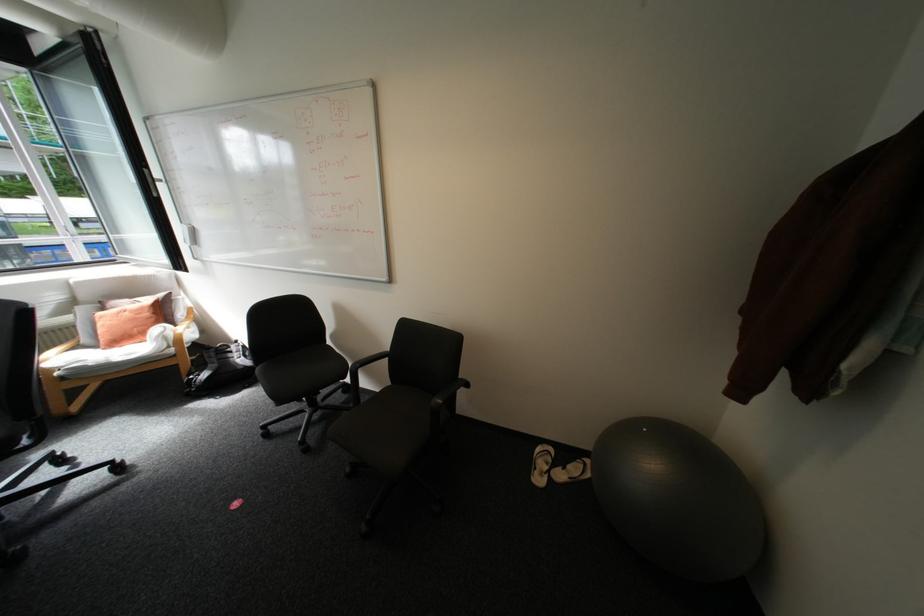
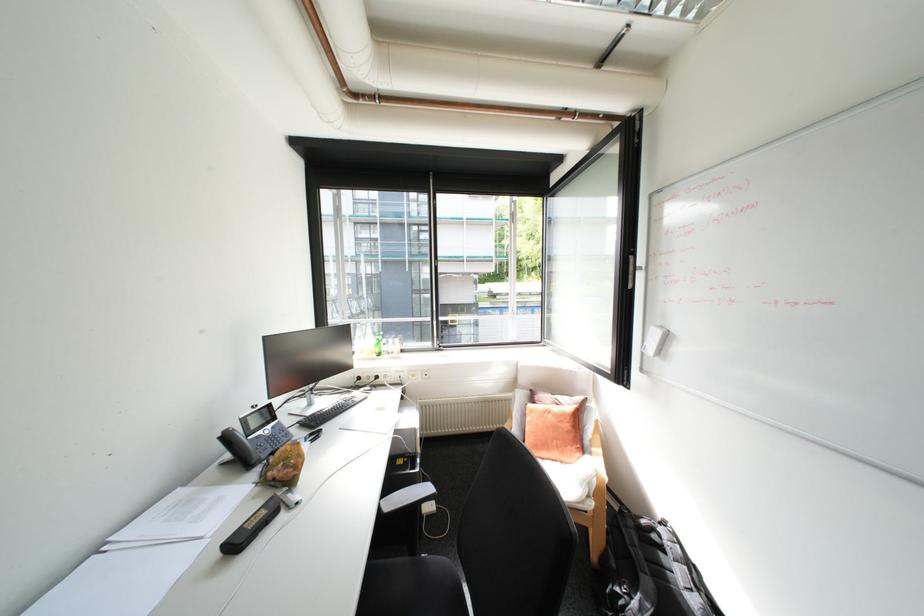
The point at (137,313) is marked in the first image. Where is the corresponding point in the second image?

(561, 416)